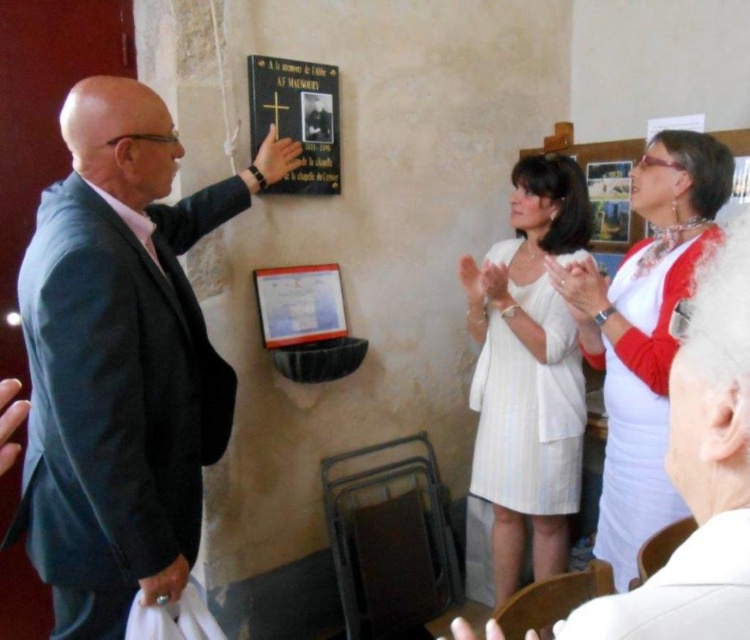
Between white textured dress at center and white satin dress at upper right, which one has more height?

With more height is white textured dress at center.

Can you confirm if white textured dress at center is taller than white satin dress at upper right?

Yes.

Image resolution: width=750 pixels, height=640 pixels. Describe the element at coordinates (528, 372) in the screenshot. I see `white textured dress at center` at that location.

The width and height of the screenshot is (750, 640). I want to click on white textured dress at center, so click(x=528, y=372).

Can you confirm if white matte dress at center is smaller than white satin dress at upper right?

Yes, white matte dress at center is smaller than white satin dress at upper right.

Between point (735, 433) and point (614, 358), which one is positioned in front?

Point (735, 433) is in front.

Does point (690, 451) lie in front of point (618, 394)?

Yes.

What are the coordinates of `white matte dress at center` in the screenshot? It's located at (699, 474).

Can you confirm if dark blue suit at left is positioned above white satin dress at upper right?

Correct, dark blue suit at left is located above white satin dress at upper right.

Where is `dark blue suit at left`? dark blue suit at left is located at coordinates (122, 358).

Find the location of a particular element. Image resolution: width=750 pixels, height=640 pixels. dark blue suit at left is located at coordinates (122, 358).

Locate an element on the screen. Image resolution: width=750 pixels, height=640 pixels. dark blue suit at left is located at coordinates (122, 358).